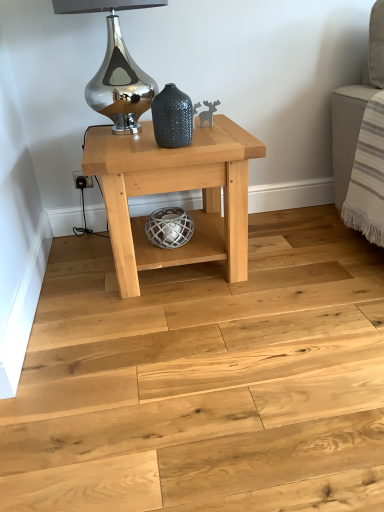
Find the location of `shiny metallic table lamp at upper center`. shiny metallic table lamp at upper center is located at coordinates (116, 67).

In order to click on natural wood table at center in this screenshot , I will do pyautogui.click(x=175, y=191).

At what (x,y) coordinates should I click in order to perform the action: click on shiny metallic table lamp at upper center. Please return your answer as a coordinate pair (x, y). Image resolution: width=384 pixels, height=512 pixels. Looking at the image, I should click on (116, 67).

In the scene shown: Considering the relative sizes of textured dark gray vase at center and natural wood table at center in the image provided, is textured dark gray vase at center thinner than natural wood table at center?

Yes, textured dark gray vase at center is thinner than natural wood table at center.

Relative to natural wood table at center, is textured dark gray vase at center in front or behind?

textured dark gray vase at center is in front of natural wood table at center.

Looking at this image, what's the angular difference between textured dark gray vase at center and natural wood table at center's facing directions?

The angular difference between textured dark gray vase at center and natural wood table at center is 25.8 degrees.

Identify the location of table lamp on the left of the natural wood floor at center. The width and height of the screenshot is (384, 512). (116, 67).

Which is more to the right, shiny metallic table lamp at upper center or natural wood floor at center?

From the viewer's perspective, natural wood floor at center appears more on the right side.

From a real-world perspective, is shiny metallic table lamp at upper center physically below natural wood floor at center?

No, from a real-world perspective, shiny metallic table lamp at upper center is not below natural wood floor at center.

Is natural wood floor at center at the back of shiny metallic table lamp at upper center?

No, natural wood floor at center is not at the back of shiny metallic table lamp at upper center.

The width and height of the screenshot is (384, 512). I want to click on table behind the natural wood floor at center, so click(x=175, y=191).

Is natural wood table at center not inside natural wood floor at center?

That's correct, natural wood table at center is outside of natural wood floor at center.

Considering the sizes of objects natural wood table at center and natural wood floor at center in the image provided, who is bigger, natural wood table at center or natural wood floor at center?

natural wood table at center.

Does textured dark gray vase at center have a lesser height compared to natural wood floor at center?

Incorrect, the height of textured dark gray vase at center does not fall short of that of natural wood floor at center.

From the picture: Considering the relative positions of textured dark gray vase at center and natural wood floor at center in the image provided, is textured dark gray vase at center to the right of natural wood floor at center from the viewer's perspective?

No.

Which is in front, point (179, 144) or point (130, 357)?

The point (130, 357) is more forward.

Considering the relative positions of textured dark gray vase at center and natural wood floor at center in the image provided, is textured dark gray vase at center in front of natural wood floor at center?

No, the depth of textured dark gray vase at center is greater than that of natural wood floor at center.

Between natural wood table at center and shiny metallic table lamp at upper center, which one is positioned behind?

Positioned behind is natural wood table at center.

Is natural wood table at center situated inside shiny metallic table lamp at upper center or outside?

natural wood table at center is located beyond the bounds of shiny metallic table lamp at upper center.

From a real-world perspective, which is physically above, natural wood table at center or shiny metallic table lamp at upper center?

shiny metallic table lamp at upper center is physically above.

Which of these two, natural wood table at center or shiny metallic table lamp at upper center, stands taller?

natural wood table at center is taller.

From a real-world perspective, between natural wood floor at center and natural wood table at center, who is vertically lower?

natural wood floor at center is physically lower.

Who is smaller, natural wood floor at center or natural wood table at center?

natural wood floor at center is smaller.

Is natural wood floor at center beside natural wood table at center?

No.

From the picture: Would you say natural wood floor at center contains natural wood table at center?

That's incorrect, natural wood table at center is not inside natural wood floor at center.

Based on the photo, considering the relative positions of textured dark gray vase at center and shiny metallic table lamp at upper center in the image provided, is textured dark gray vase at center to the left or to the right of shiny metallic table lamp at upper center?

Clearly, textured dark gray vase at center is on the right of shiny metallic table lamp at upper center in the image.

From a real-world perspective, is textured dark gray vase at center above or below shiny metallic table lamp at upper center?

textured dark gray vase at center is situated lower than shiny metallic table lamp at upper center in the real world.

Does textured dark gray vase at center have a smaller size compared to shiny metallic table lamp at upper center?

Yes.

Does textured dark gray vase at center turn towards shiny metallic table lamp at upper center?

No, textured dark gray vase at center does not turn towards shiny metallic table lamp at upper center.

Find the location of a particular element. This screenshot has height=512, width=384. table directly beneath the textured dark gray vase at center (from a real-world perspective) is located at coordinates (175, 191).

The height and width of the screenshot is (512, 384). Identify the location of table lamp that is behind the natural wood floor at center. (116, 67).

Considering their positions, is natural wood floor at center positioned closer to natural wood table at center than shiny metallic table lamp at upper center?

shiny metallic table lamp at upper center lies closer to natural wood table at center than the other object.

Estimate the real-world distances between objects in this image. Which object is closer to natural wood floor at center, shiny metallic table lamp at upper center or natural wood table at center?

Based on the image, natural wood table at center appears to be nearer to natural wood floor at center.

Considering their positions, is natural wood floor at center positioned further to textured dark gray vase at center than natural wood table at center?

Based on the image, natural wood floor at center appears to be further to textured dark gray vase at center.

Estimate the real-world distances between objects in this image. Which object is further from shiny metallic table lamp at upper center, natural wood table at center or textured dark gray vase at center?

Based on the image, textured dark gray vase at center appears to be further to shiny metallic table lamp at upper center.

From the image, which object appears to be farther from natural wood floor at center, natural wood table at center or shiny metallic table lamp at upper center?

The object further to natural wood floor at center is shiny metallic table lamp at upper center.

Considering their positions, is shiny metallic table lamp at upper center positioned closer to natural wood table at center than natural wood floor at center?

shiny metallic table lamp at upper center is positioned closer to the anchor natural wood table at center.

Based on their spatial positions, is natural wood table at center or textured dark gray vase at center closer to natural wood floor at center?

Among the two, natural wood table at center is located nearer to natural wood floor at center.

Based on their spatial positions, is shiny metallic table lamp at upper center or natural wood floor at center further from textured dark gray vase at center?

Among the two, natural wood floor at center is located further to textured dark gray vase at center.

You are a GUI agent. You are given a task and a screenshot of the screen. Output one action in this format:
    pyautogui.click(x=<x>, y=<y>)
    Task: Click on the table between shiny metallic table lamp at upper center and natural wood floor at center in the up-down direction
    This screenshot has width=384, height=512.
    Given the screenshot: What is the action you would take?
    pyautogui.click(x=175, y=191)

Where is `table between textured dark gray vase at center and natural wood floor at center from top to bottom`? The width and height of the screenshot is (384, 512). table between textured dark gray vase at center and natural wood floor at center from top to bottom is located at coordinates (175, 191).

Locate an element on the screen. The width and height of the screenshot is (384, 512). vase between shiny metallic table lamp at upper center and natural wood floor at center in the up-down direction is located at coordinates (172, 117).

At what (x,y) coordinates should I click in order to perform the action: click on vase between shiny metallic table lamp at upper center and natural wood table at center in the vertical direction. Please return your answer as a coordinate pair (x, y). Image resolution: width=384 pixels, height=512 pixels. Looking at the image, I should click on (172, 117).